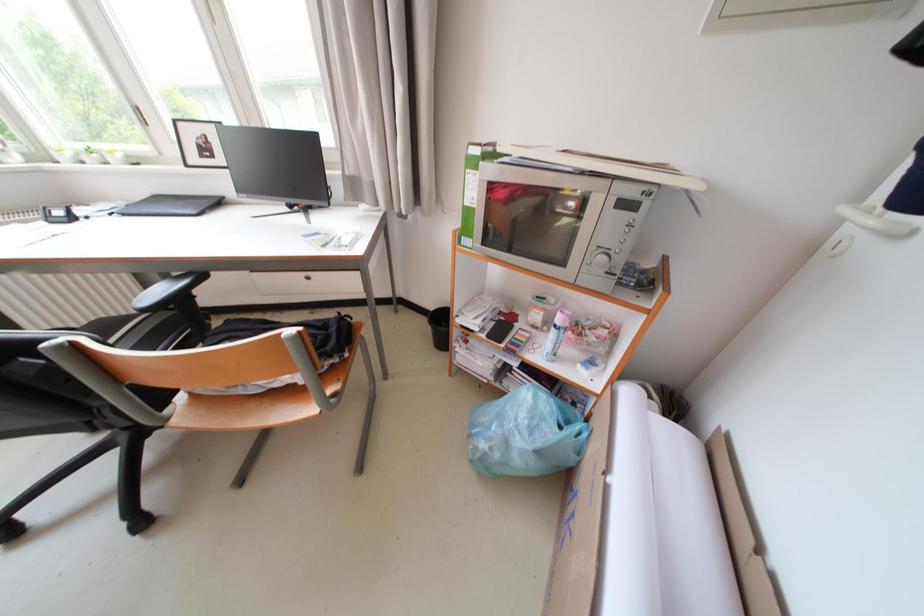
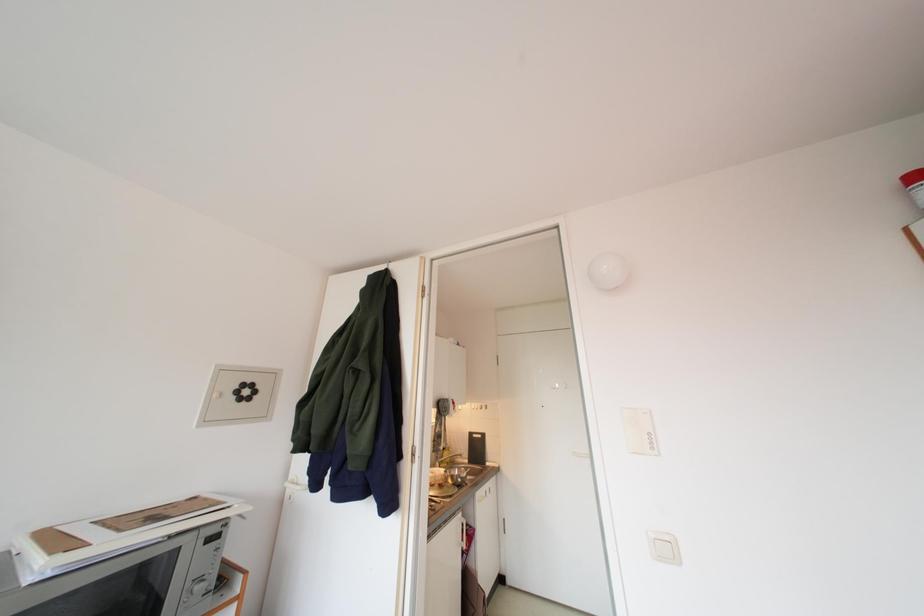
Question: Based on the continuous images, in which direction is the camera rotating? Reply with the corresponding letter.

Choices:
 (A) Left
 (B) Right
 (C) Up
 (D) Down

Answer: (B)